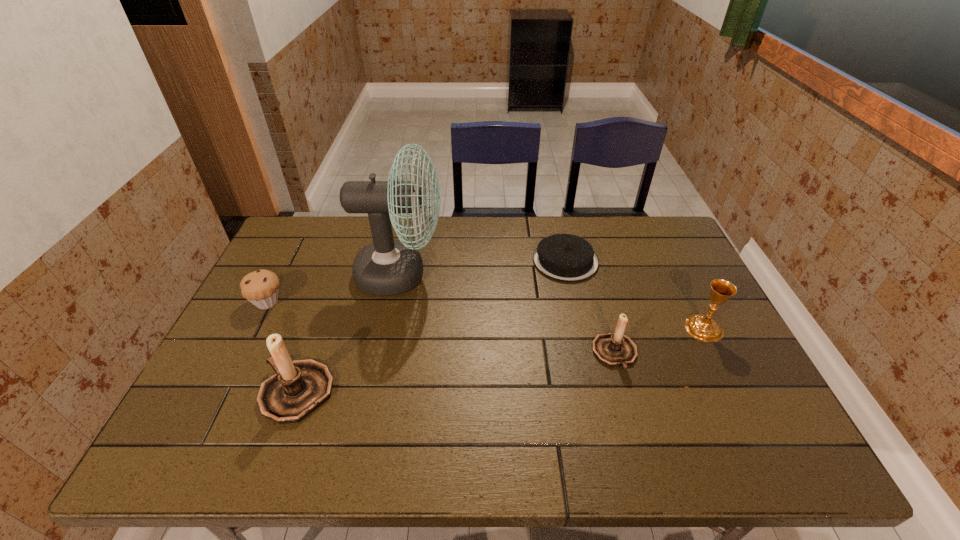
Please point a location where one more candle_holder can be added evenly. Please provide its 2D coordinates. Your answer should be formatted as a tuple, i.e. [(x, y)], where the tuple contains the x and y coordinates of a point satisfying the conditions above.

[(462, 372)]